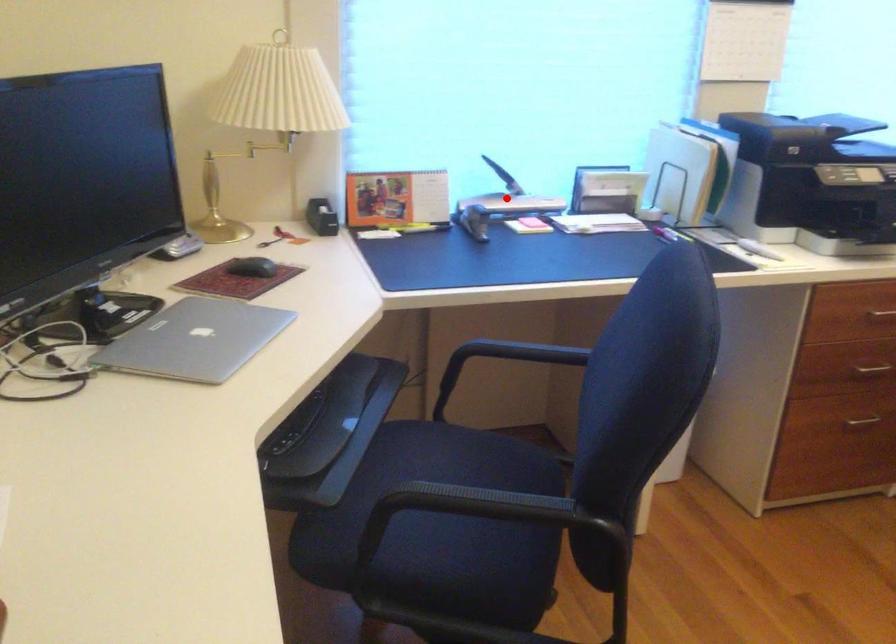
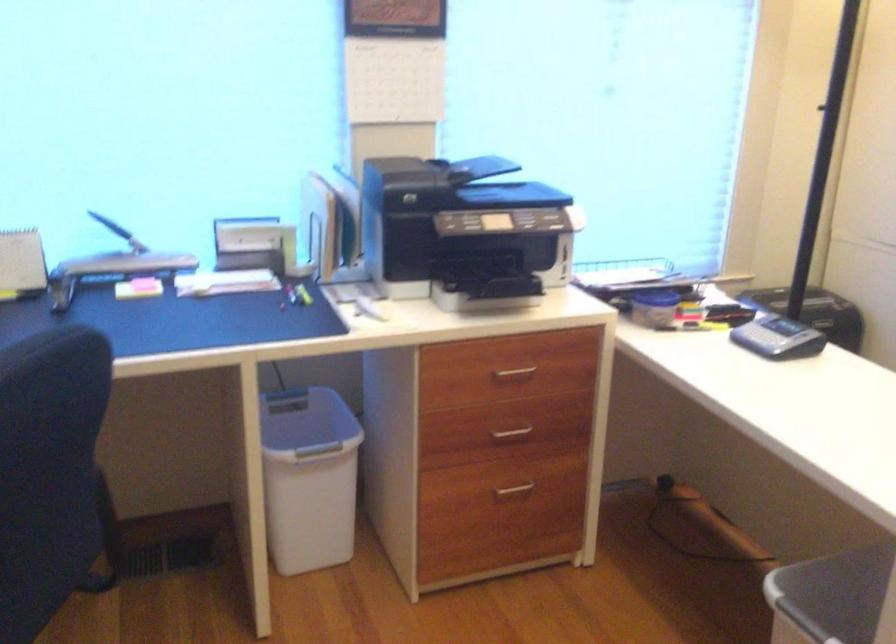
Where in the second image is the point corresponding to the highlighted location from the first image?

(124, 257)